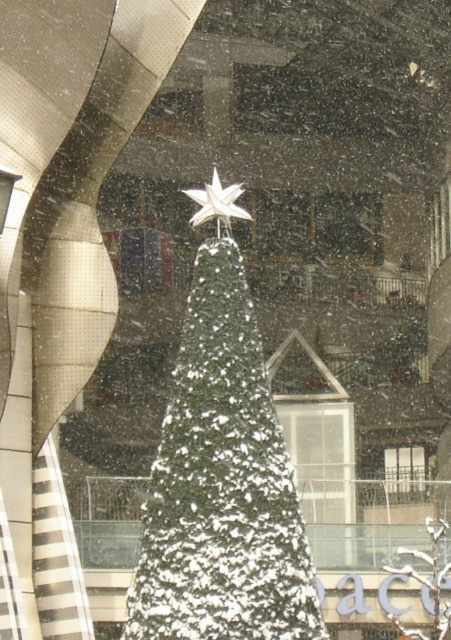
You are standing in the festive scene and want to walk from your current position to the point marked as point [383,472]. However, there is an obstacle at point [196,272]. Can you safely walk around the obstacle to reach your destination?

Point [196,272] is in front of point [383,472], so you cannot safely walk around the obstacle to reach your destination because the obstacle is blocking the path directly in front of the destination.

You are standing in the festive scene and want to place a decoration between the two points, point (x=230, y=192) and point (x=403, y=474). Which point should the decoration be closer to in order to be in front of the other point?

The decoration should be closer to point (x=230, y=192) because it is in front of point (x=403, y=474).